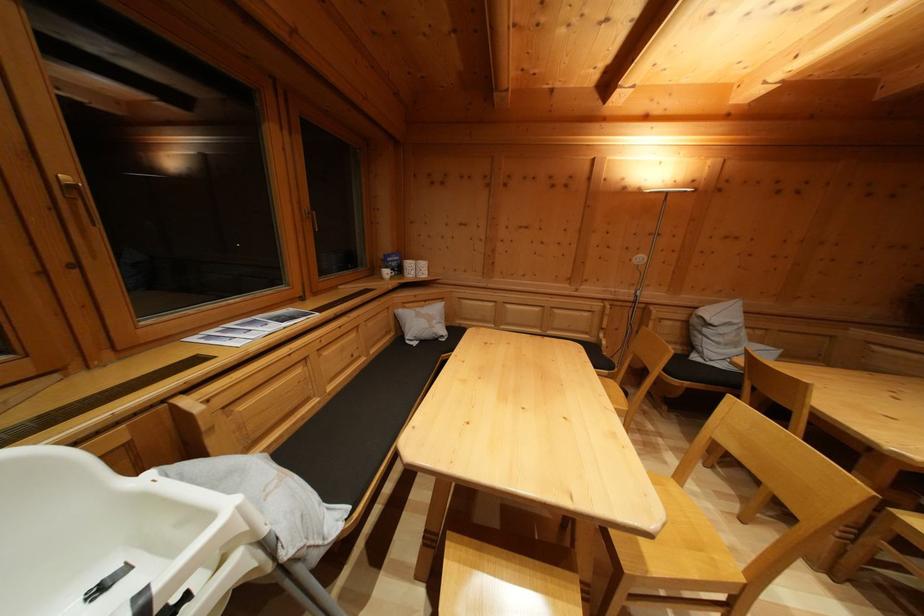
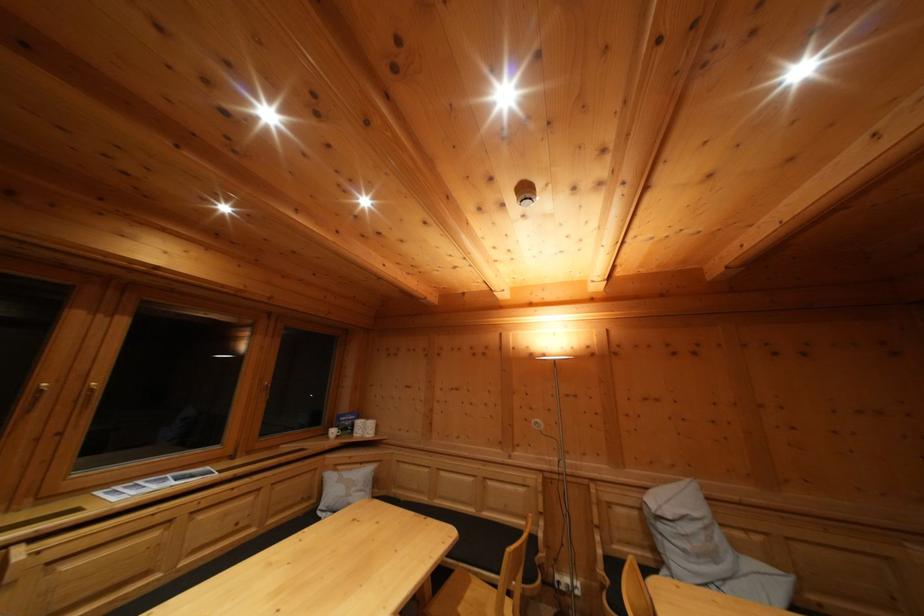
Find the pixel in the second image that matches [431,308] in the first image.

(368, 469)